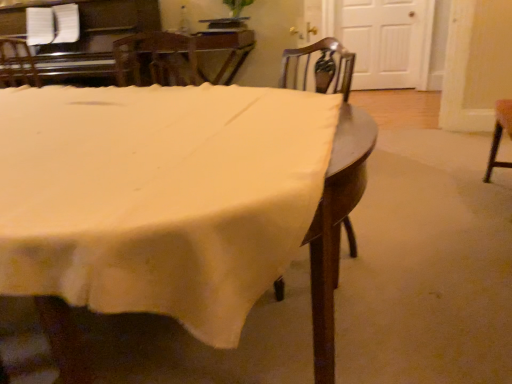
Question: In terms of height, does white fabric table at center look taller or shorter compared to wooden at center?

Choices:
 (A) tall
 (B) short

Answer: (B)

Question: Is white fabric table at center inside or outside of wooden at center?

Choices:
 (A) outside
 (B) inside

Answer: (A)

Question: Is white fabric table at center bigger or smaller than wooden at center?

Choices:
 (A) small
 (B) big

Answer: (B)

Question: From a real-world perspective, is wooden at center positioned above or below white fabric table at center?

Choices:
 (A) above
 (B) below

Answer: (A)

Question: Considering their positions, is wooden at center located in front of or behind white fabric table at center?

Choices:
 (A) behind
 (B) front

Answer: (A)

Question: Is wooden at center inside the boundaries of white fabric table at center, or outside?

Choices:
 (A) inside
 (B) outside

Answer: (A)

Question: In terms of width, does wooden at center look wider or thinner when compared to white fabric table at center?

Choices:
 (A) wide
 (B) thin

Answer: (B)